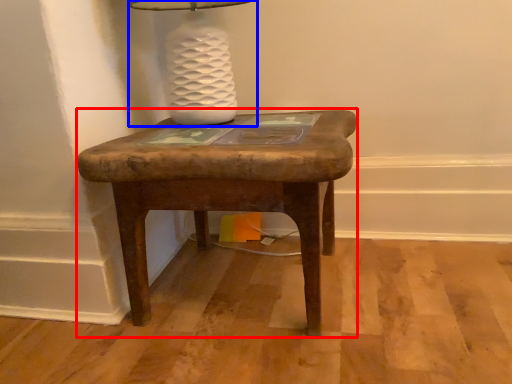
Question: Among these objects, which one is nearest to the camera, stool (highlighted by a red box) or table lamp (highlighted by a blue box)?

Choices:
 (A) stool
 (B) table lamp

Answer: (A)